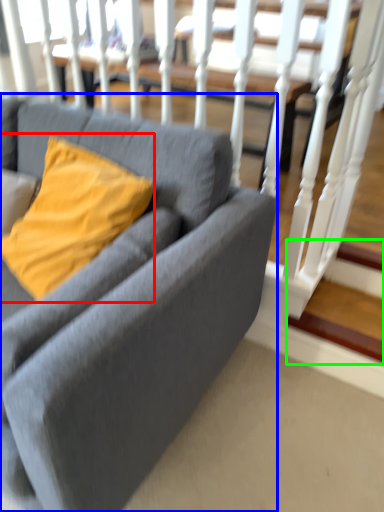
Question: Which object is the closest to the pillow (highlighted by a red box)? Choose among these: studio couch (highlighted by a blue box) or stairwell (highlighted by a green box).

Choices:
 (A) studio couch
 (B) stairwell

Answer: (A)